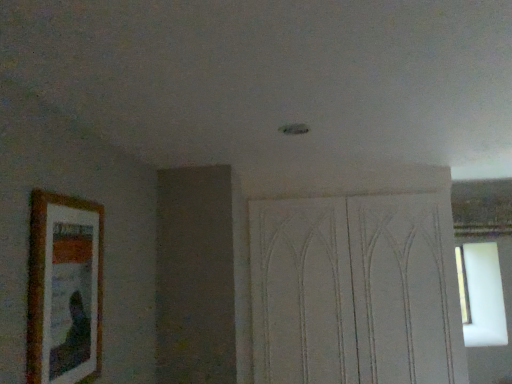
Question: From the image's perspective, is white textured screen door at center above wooden picture frame at left?

Choices:
 (A) yes
 (B) no

Answer: (B)

Question: Does white textured screen door at center have a lesser height compared to wooden picture frame at left?

Choices:
 (A) no
 (B) yes

Answer: (A)

Question: Does white textured screen door at center have a smaller size compared to wooden picture frame at left?

Choices:
 (A) yes
 (B) no

Answer: (B)

Question: Are white textured screen door at center and wooden picture frame at left beside each other?

Choices:
 (A) yes
 (B) no

Answer: (B)

Question: Is white textured screen door at center oriented towards wooden picture frame at left?

Choices:
 (A) no
 (B) yes

Answer: (B)

Question: From a real-world perspective, is white textured screen door at center located beneath wooden picture frame at left?

Choices:
 (A) no
 (B) yes

Answer: (B)

Question: From the image's perspective, is wooden picture frame at left located above white textured screen door at center?

Choices:
 (A) no
 (B) yes

Answer: (B)

Question: Does wooden picture frame at left touch white textured screen door at center?

Choices:
 (A) no
 (B) yes

Answer: (A)

Question: From the image's perspective, is wooden picture frame at left located beneath white textured screen door at center?

Choices:
 (A) yes
 (B) no

Answer: (B)

Question: Is wooden picture frame at left positioned before white textured screen door at center?

Choices:
 (A) yes
 (B) no

Answer: (A)

Question: From a real-world perspective, is wooden picture frame at left located beneath white textured screen door at center?

Choices:
 (A) no
 (B) yes

Answer: (A)

Question: Can you confirm if wooden picture frame at left is taller than white textured screen door at center?

Choices:
 (A) yes
 (B) no

Answer: (B)

Question: From the image's perspective, relative to wooden picture frame at left, is white textured screen door at center above or below?

Choices:
 (A) above
 (B) below

Answer: (B)